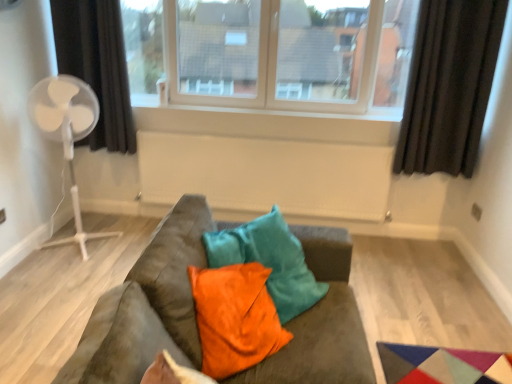
Locate an element on the screen. This screenshot has width=512, height=384. free point below transparent glass window at center (from a real-world perspective) is located at coordinates (263, 105).